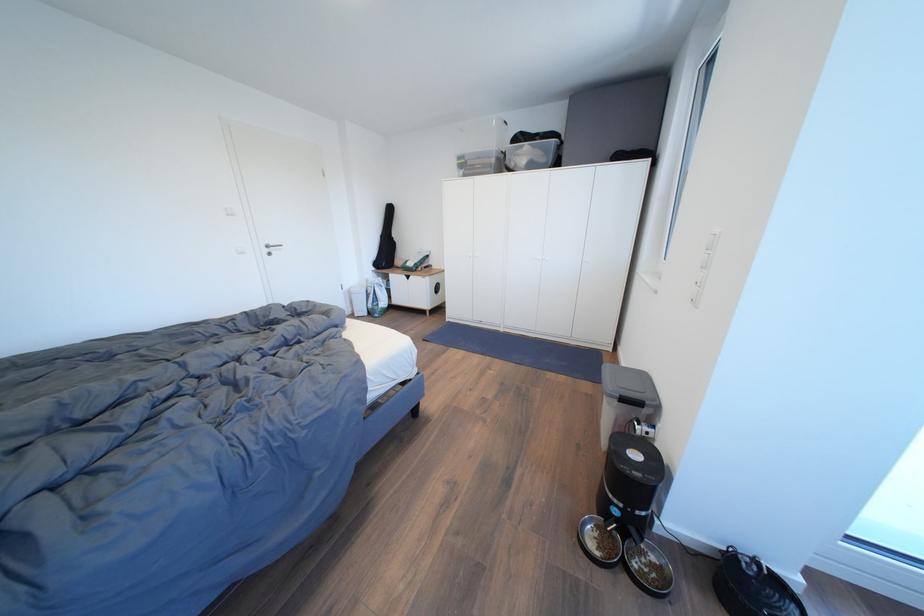
Where would you unlatch the bin lid? Please return your answer as a coordinate pair (x, y).

(636, 458)